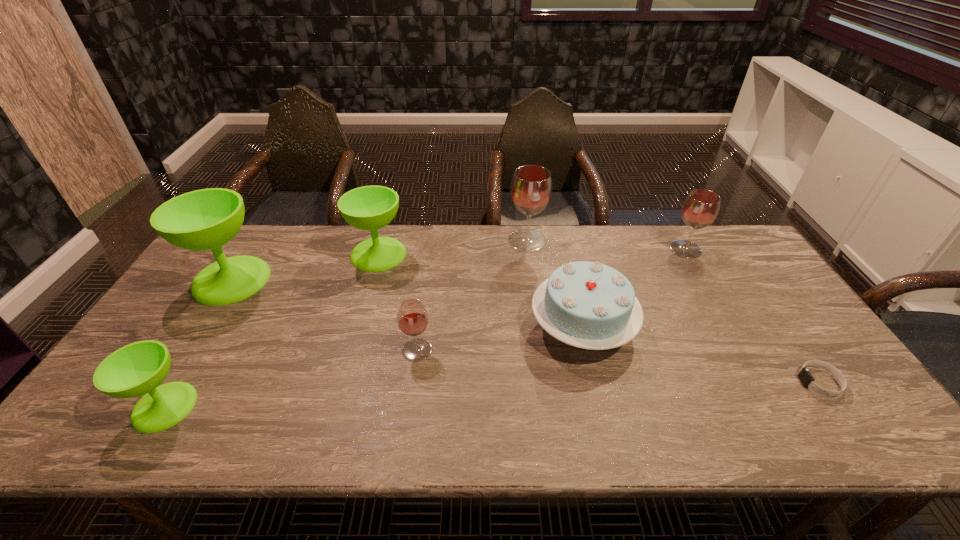
At what (x,y) coordinates should I click in order to perform the action: click on the nearest green wineglass. Please return your answer as a coordinate pair (x, y). The image size is (960, 540). Looking at the image, I should click on (139, 368).

Where is `the smallest green wineglass`? The height and width of the screenshot is (540, 960). the smallest green wineglass is located at coordinates pos(139,368).

This screenshot has height=540, width=960. Identify the location of the shortest object. (806, 378).

You are a GUI agent. You are given a task and a screenshot of the screen. Output one action in this format:
    pyautogui.click(x=<x>, y=<y>)
    Task: Click on the wristband
    The height and width of the screenshot is (540, 960).
    Given the screenshot: What is the action you would take?
    pyautogui.click(x=806, y=378)

Identify the location of free space located 0.390m on the left of the biggest red wineglass. (394, 241).

Locate an element on the screen. The image size is (960, 540). vacant region located 0.320m on the front of the biggest green wineglass is located at coordinates click(x=153, y=402).

Where is `vacant space located 0.310m on the left of the second biggest red wineglass`? The width and height of the screenshot is (960, 540). vacant space located 0.310m on the left of the second biggest red wineglass is located at coordinates (577, 249).

Identify the location of blank space located on the right of the rightmost green wineglass. This screenshot has height=540, width=960. (x=472, y=254).

The width and height of the screenshot is (960, 540). In order to click on blank area located 0.120m on the back of the blue birthday cake in this screenshot , I will do `click(568, 265)`.

At what (x,y) coordinates should I click in order to perform the action: click on free space located on the front of the fourth object from left to right. Please return your answer as a coordinate pair (x, y). Image resolution: width=960 pixels, height=540 pixels. Looking at the image, I should click on (411, 393).